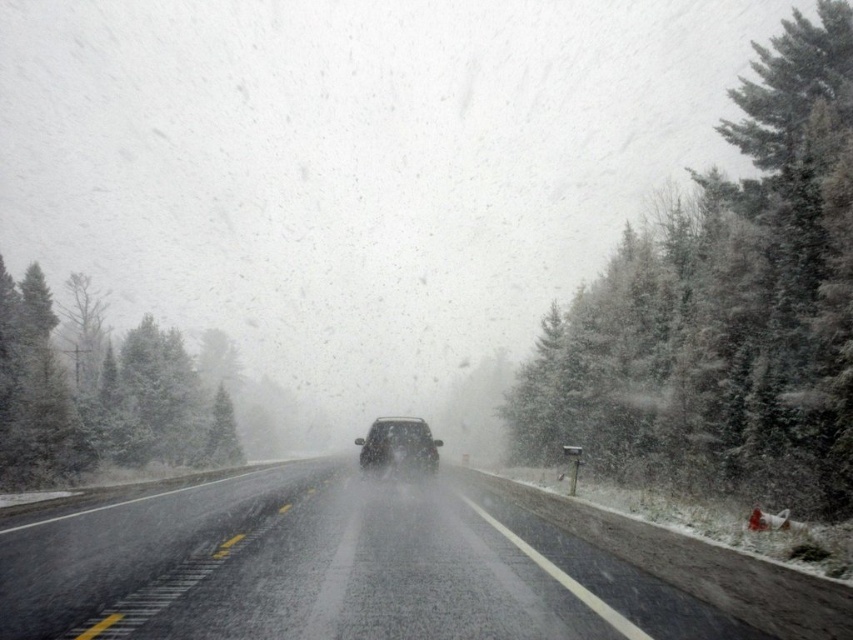
Which is more to the left, snow-covered evergreen at right or sleek black suv at center?

Positioned to the left is sleek black suv at center.

Is snow-covered evergreen at right taller than sleek black suv at center?

Correct, snow-covered evergreen at right is much taller as sleek black suv at center.

Does point (843, 499) come behind point (422, 472)?

That is True.

You are a GUI agent. You are given a task and a screenshot of the screen. Output one action in this format:
    pyautogui.click(x=<x>, y=<y>)
    Task: Click on the snow-covered evergreen at right
    This screenshot has width=853, height=640.
    Given the screenshot: What is the action you would take?
    pyautogui.click(x=724, y=307)

Is glossy asphalt highway at center positioned at the back of sleek black suv at center?

No, it is in front of sleek black suv at center.

Does glossy asphalt highway at center have a greater width compared to sleek black suv at center?

Correct, the width of glossy asphalt highway at center exceeds that of sleek black suv at center.

Is point (444, 618) behind point (421, 452)?

No, (444, 618) is closer to viewer.

You are a GUI agent. You are given a task and a screenshot of the screen. Output one action in this format:
    pyautogui.click(x=<x>, y=<y>)
    Task: Click on the glossy asphalt highway at center
    The height and width of the screenshot is (640, 853).
    Given the screenshot: What is the action you would take?
    pyautogui.click(x=350, y=570)

Is snow-covered evergreen at right positioned before glossy asphalt highway at center?

No, snow-covered evergreen at right is behind glossy asphalt highway at center.

Is point (630, 227) farther from viewer compared to point (567, 604)?

Yes, point (630, 227) is behind point (567, 604).

This screenshot has height=640, width=853. I want to click on snow-covered evergreen at right, so click(x=724, y=307).